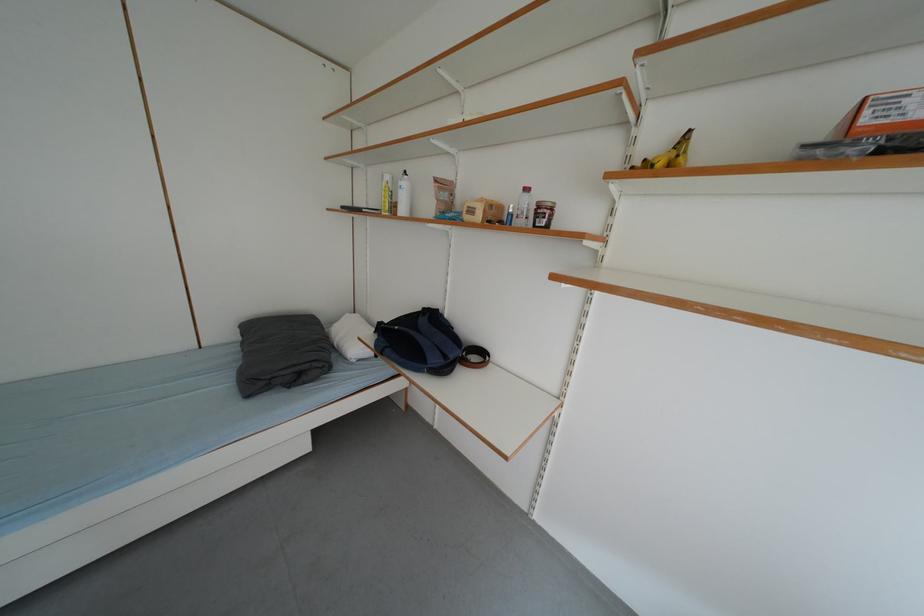
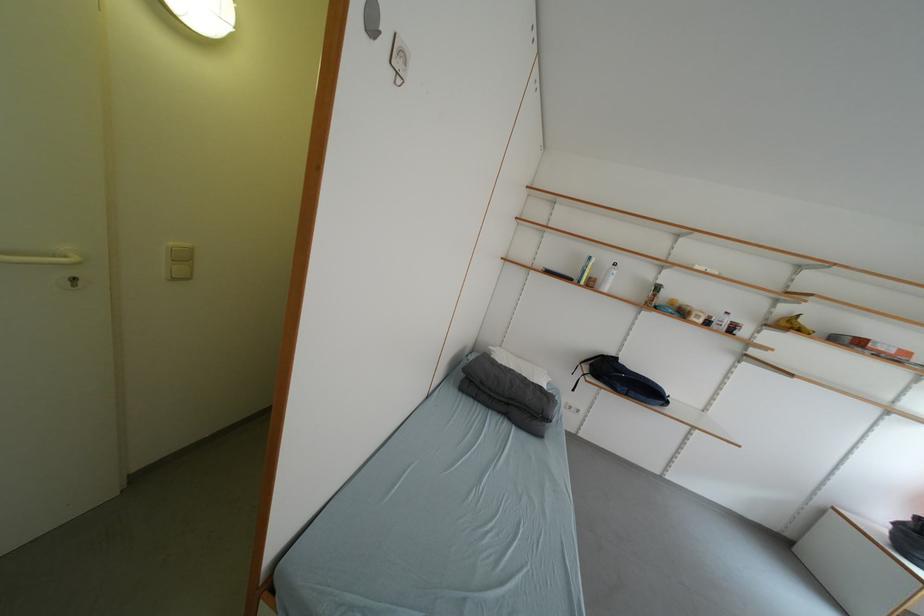
Question: What movement of the cameraman would produce the second image?

Choices:
 (A) Left
 (B) Right
 (C) Forward
 (D) Backward

Answer: (A)